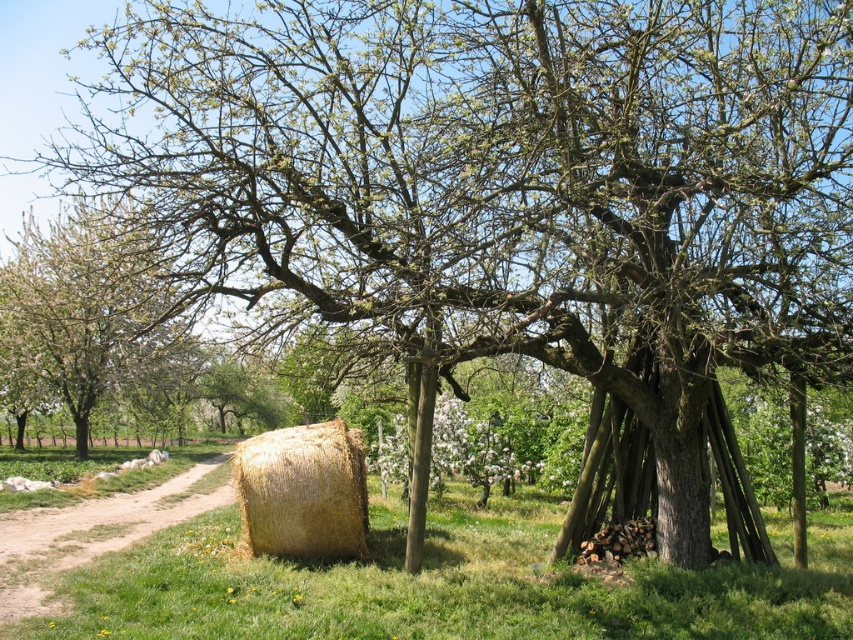
Question: Is green grass at lower left above brown dirt track at lower left?

Choices:
 (A) yes
 (B) no

Answer: (A)

Question: Does golden straw bale at center appear on the right side of brown dirt track at lower left?

Choices:
 (A) yes
 (B) no

Answer: (A)

Question: Which point appears closest to the camera in this image?

Choices:
 (A) (41, 532)
 (B) (76, 228)

Answer: (A)

Question: Which object is the farthest from the white blossoming tree at center?

Choices:
 (A) golden straw bale at center
 (B) brown dirt track at lower left
 (C) green grass at lower left

Answer: (C)

Question: Is white blossoming tree at center positioned in front of brown dirt track at lower left?

Choices:
 (A) yes
 (B) no

Answer: (B)

Question: Which object is the closest to the white blossoming tree at center?

Choices:
 (A) green grass at lower left
 (B) golden straw bale at center

Answer: (B)